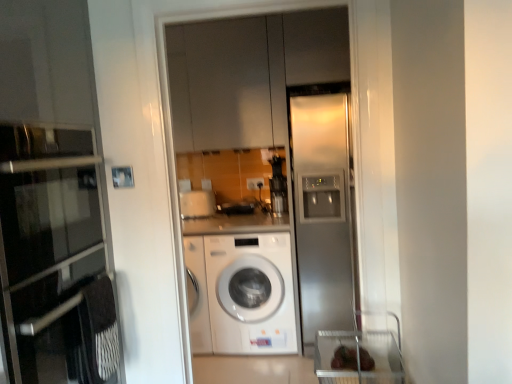
Question: Is matte glass oven at left taller or shorter than satin silver refrigerator at center?

Choices:
 (A) short
 (B) tall

Answer: (A)

Question: Looking at the image, does matte glass oven at left seem bigger or smaller compared to satin silver refrigerator at center?

Choices:
 (A) big
 (B) small

Answer: (A)

Question: Which object is positioned closest to the satin silver refrigerator at center?

Choices:
 (A) matte glass oven at left
 (B) stainless steel refrigerator at right
 (C) white plastic electric outlet at center
 (D) white matte cabinet at upper center
 (E) white glossy washing machine at center

Answer: (B)

Question: Considering the real-world distances, which object is farthest from the stainless steel refrigerator at right?

Choices:
 (A) matte glass oven at left
 (B) white plastic electric outlet at center
 (C) white matte cabinet at upper center
 (D) satin silver refrigerator at center
 (E) white glossy washing machine at center

Answer: (A)